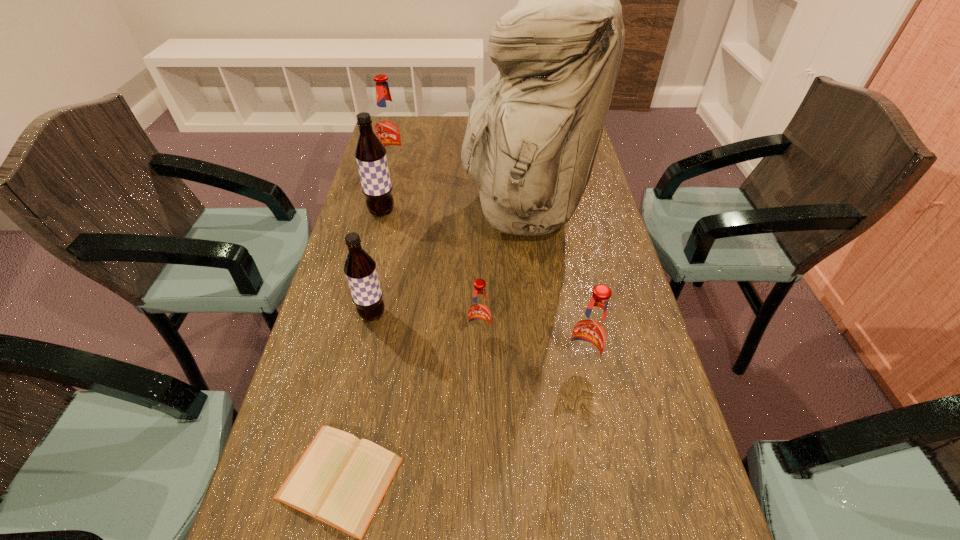
You are a GUI agent. You are given a task and a screenshot of the screen. Output one action in this format:
    pyautogui.click(x=<x>, y=<y>)
    Task: Click on the fourth farthest root beer
    This screenshot has width=960, height=540.
    Given the screenshot: What is the action you would take?
    pyautogui.click(x=479, y=312)

The height and width of the screenshot is (540, 960). I want to click on free space located on the front-facing side of the tallest object, so click(414, 209).

Locate an element on the screen. free space located 0.170m on the front-facing side of the tallest object is located at coordinates (406, 209).

The image size is (960, 540). Identify the location of vacant space located on the front-facing side of the tallest object. [x=423, y=209].

The image size is (960, 540). Find the location of `free spot located 0.320m on the right of the farthest root beer`. free spot located 0.320m on the right of the farthest root beer is located at coordinates (503, 167).

This screenshot has height=540, width=960. Identify the location of blank space located 0.100m on the front of the second farthest root beer. (373, 244).

Find the location of a particular element. vacant space located on the front of the fourth nearest object is located at coordinates (340, 464).

Where is `vacant space located on the back of the second biggest red root beer`? This screenshot has height=540, width=960. vacant space located on the back of the second biggest red root beer is located at coordinates (574, 332).

Find the location of a particular element. This screenshot has height=540, width=960. vacant space positioned 0.120m on the front of the third nearest object is located at coordinates (480, 397).

Identify the location of backpack located in the right edge section of the desktop. The width and height of the screenshot is (960, 540). tap(533, 131).